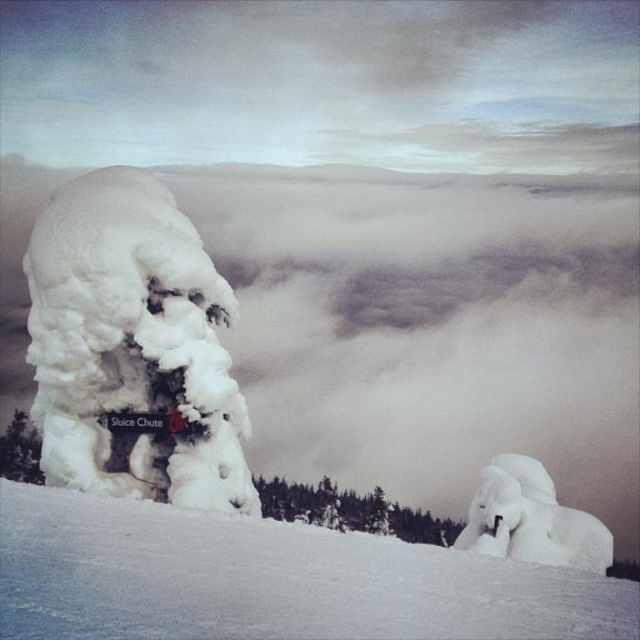
Which is more to the right, white snow at lower center or white fluffy snow at left?

white snow at lower center

Is white snow at lower center to the right of white fluffy snow at left from the viewer's perspective?

Correct, you'll find white snow at lower center to the right of white fluffy snow at left.

The height and width of the screenshot is (640, 640). Identify the location of white snow at lower center. (268, 579).